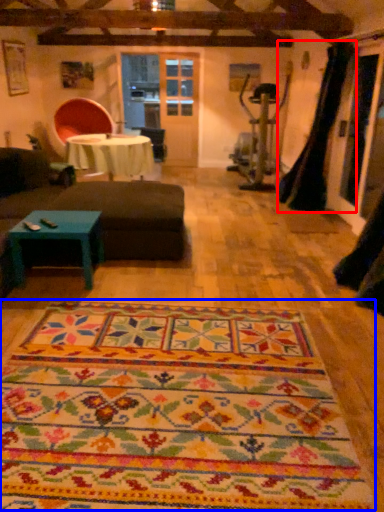
Question: Among these objects, which one is nearest to the camera, curtain (highlighted by a red box) or mat (highlighted by a blue box)?

Choices:
 (A) curtain
 (B) mat

Answer: (B)